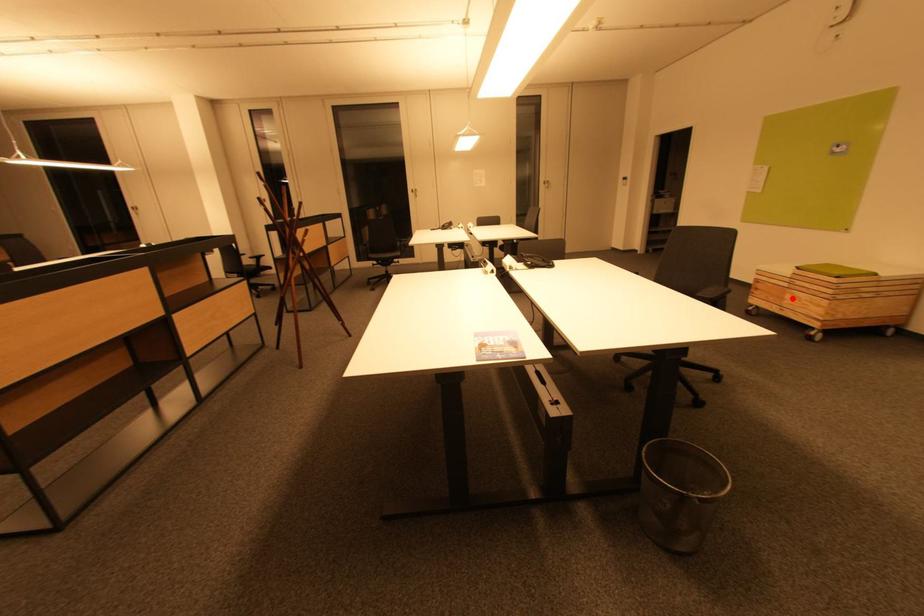
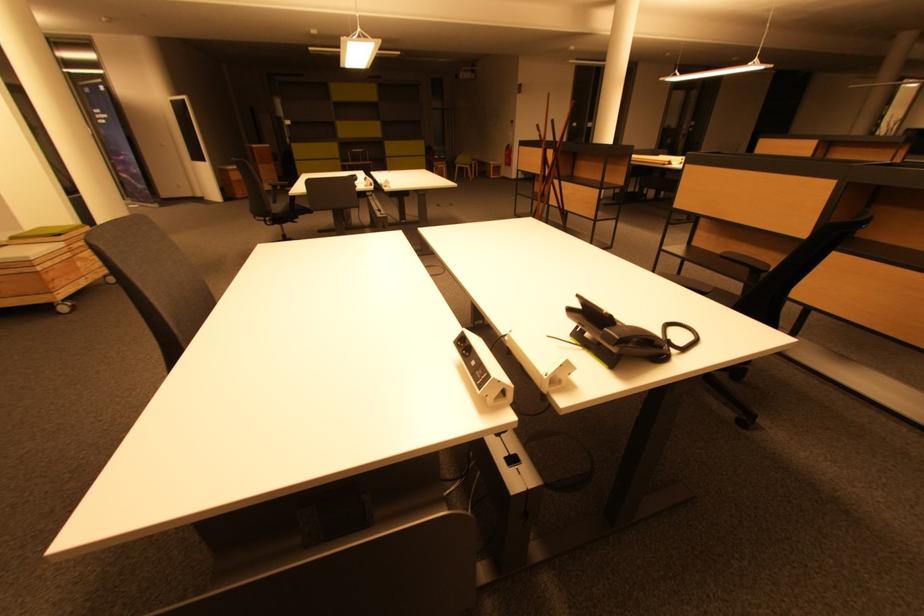
Where in the second image is the point corresponding to the highlighted location from the first image?

(83, 265)